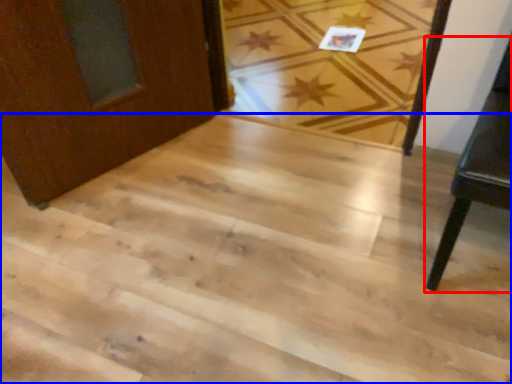
Question: Which of the following is the closest to the observer, furniture (highlighted by a red box) or stairwell (highlighted by a blue box)?

Choices:
 (A) furniture
 (B) stairwell

Answer: (A)